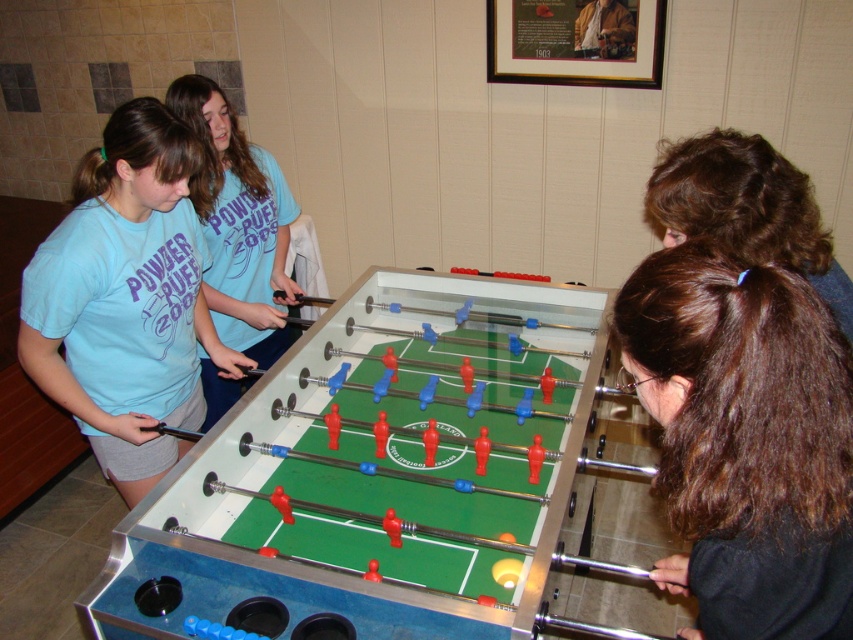
Question: Can you confirm if light blue cotton shirt at upper left is positioned above brown curly hair at center?

Choices:
 (A) yes
 (B) no

Answer: (A)

Question: Which point is farther to the camera?

Choices:
 (A) brown hair at lower right
 (B) metallic green foosball table at center

Answer: (B)

Question: Based on their relative distances, which object is nearer to the light blue cotton shirt at upper left?

Choices:
 (A) brown hair at lower right
 (B) matte blue shirt at left
 (C) brown curly hair at center

Answer: (B)

Question: Which of the following is the farthest from the observer?

Choices:
 (A) (206, 140)
 (B) (728, 204)
 (C) (202, 253)

Answer: (C)

Question: Is matte blue shirt at left to the left of brown curly hair at center from the viewer's perspective?

Choices:
 (A) no
 (B) yes

Answer: (B)

Question: Can you confirm if brown hair at lower right is thinner than light blue cotton shirt at upper left?

Choices:
 (A) no
 (B) yes

Answer: (B)